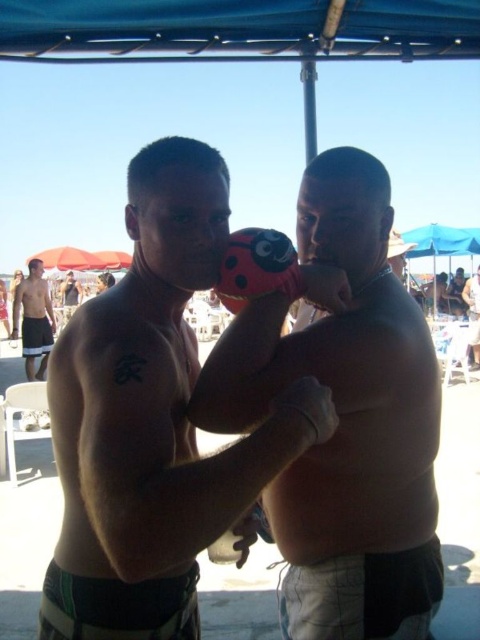
Question: Which point is closer to the camera?

Choices:
 (A) shiny metallic helmet at center
 (B) shiny black shorts at left
 (C) smooth skin man at center

Answer: (C)

Question: Among these objects, which one is nearest to the camera?

Choices:
 (A) shiny black shorts at left
 (B) matte black boxing glove at center
 (C) smooth skin man at center

Answer: (B)

Question: Which point is farther from the camera taking this photo?

Choices:
 (A) (313, 198)
 (B) (27, 312)

Answer: (B)

Question: Is shiny black shorts at left positioned at the back of smooth skin man at center?

Choices:
 (A) yes
 (B) no

Answer: (A)

Question: Can you confirm if pink matte boxing glove at center is bigger than smooth skin man at center?

Choices:
 (A) no
 (B) yes

Answer: (A)

Question: Is the position of smooth skin man at center less distant than that of shiny metallic helmet at center?

Choices:
 (A) no
 (B) yes

Answer: (B)